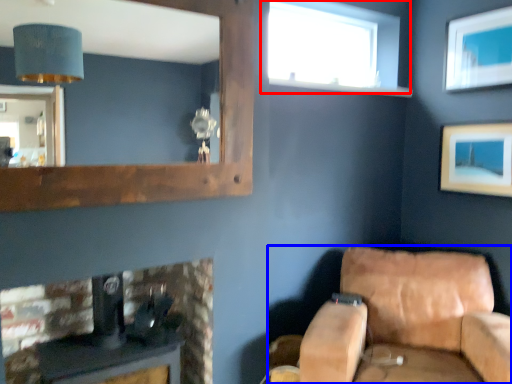
Question: Which point is closer to the camera, window (highlighted by a red box) or studio couch (highlighted by a blue box)?

Choices:
 (A) window
 (B) studio couch

Answer: (B)